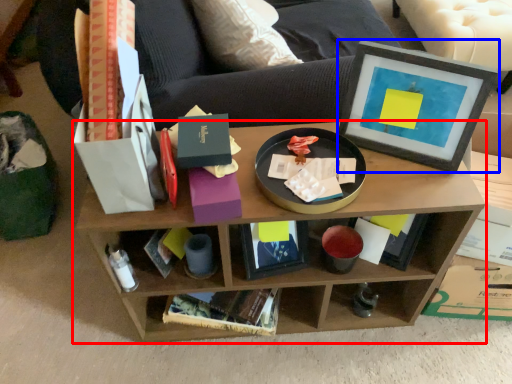
Question: Which point is closer to the camera, shelf (highlighted by a red box) or picture frame (highlighted by a blue box)?

Choices:
 (A) shelf
 (B) picture frame

Answer: (B)